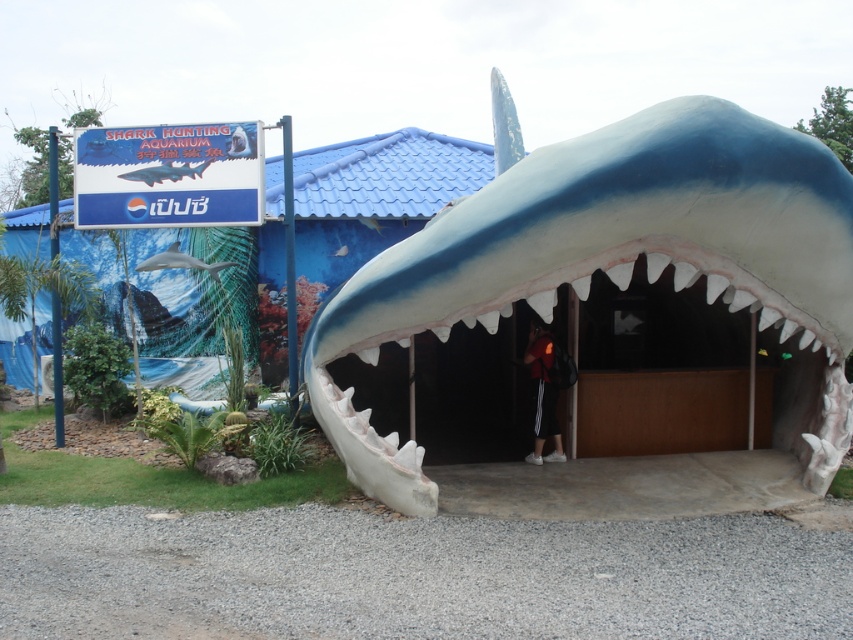
Is blue matte shark at center positioned in front of dark blue hoodie at center?

No, it is not.

Where is `blue matte shark at center`? blue matte shark at center is located at coordinates (616, 317).

Can you confirm if blue matte shark at center is smaller than smooth gray shark at upper left?

Actually, blue matte shark at center might be larger than smooth gray shark at upper left.

Who is taller, blue matte shark at center or smooth gray shark at upper left?

Standing taller between the two is blue matte shark at center.

You are a GUI agent. You are given a task and a screenshot of the screen. Output one action in this format:
    pyautogui.click(x=<x>, y=<y>)
    Task: Click on the blue matte shark at center
    This screenshot has width=853, height=640.
    Given the screenshot: What is the action you would take?
    (x=616, y=317)

Which is more to the right, blue matte shark at center or white smooth shark at center?

Positioned to the right is blue matte shark at center.

Does blue matte shark at center appear on the right side of white smooth shark at center?

Indeed, blue matte shark at center is positioned on the right side of white smooth shark at center.

Is point (466, 253) behind point (175, 244)?

No.

Locate an element on the screen. blue matte shark at center is located at coordinates (616, 317).